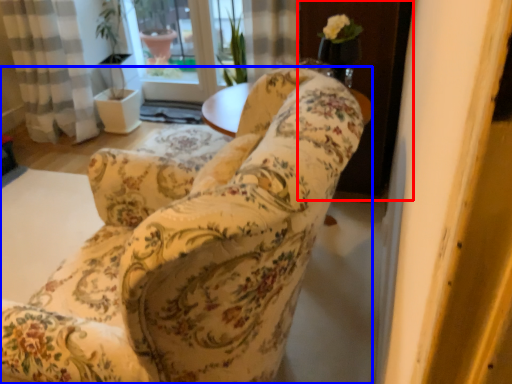
Question: Which object appears farthest to the camera in this image, screen door (highlighted by a red box) or chair (highlighted by a blue box)?

Choices:
 (A) screen door
 (B) chair

Answer: (A)